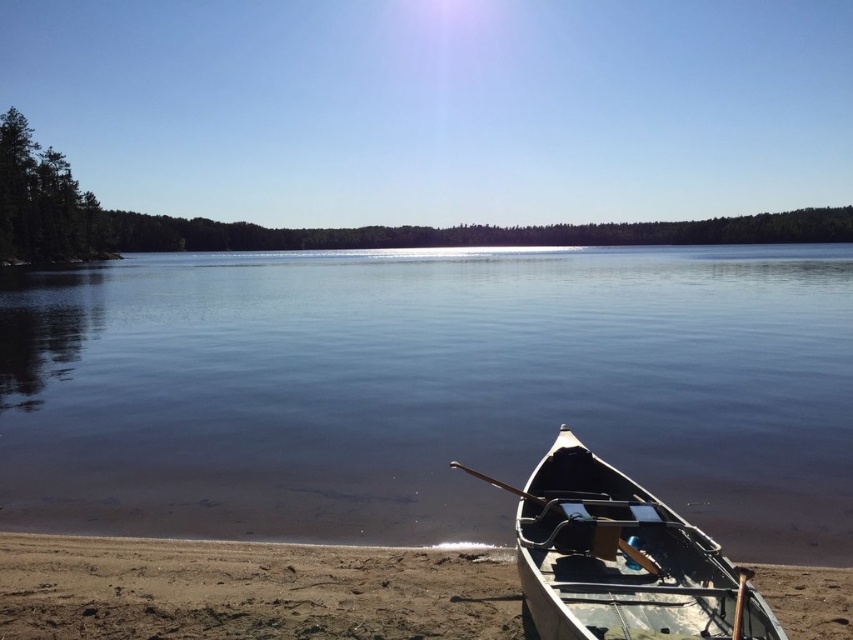
You are planning to take a photo of the clear water at center and the light gray wooden canoe at lower right. Which object will appear taller in the photo?

The clear water at center appears taller in the photo since it has a greater height compared to the light gray wooden canoe at lower right according to the description.

You are planning to cross the lake in a small boat that requires a minimum of 3 meters of width to navigate safely. Based on the scene, can the clear water at center provide sufficient width compared to the brown sandy beach at lower right?

The clear water at center is wider than the brown sandy beach at lower right, so it can provide sufficient width for the boat to navigate safely.

You are planning to take a photo of the light gray wooden canoe at lower right and the clear water at center. Which object should you focus on first if you want to capture both in a single shot without moving the camera?

The clear water at center is bigger than the light gray wooden canoe at lower right, so you should focus on the clear water at center first to ensure it fills the frame appropriately before adjusting for the smaller canoe.